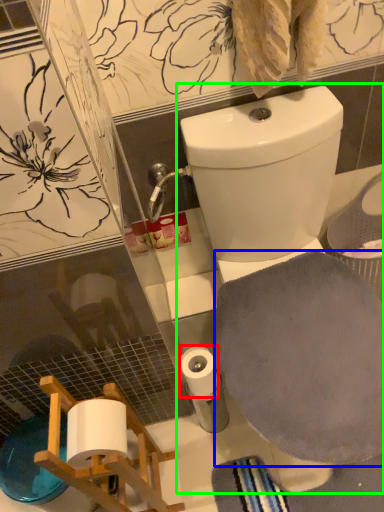
Question: Based on their relative distances, which object is nearer to toilet paper (highlighted by a red box)? Choose from bath towel (highlighted by a blue box) and toilet (highlighted by a green box).

Choices:
 (A) bath towel
 (B) toilet

Answer: (A)